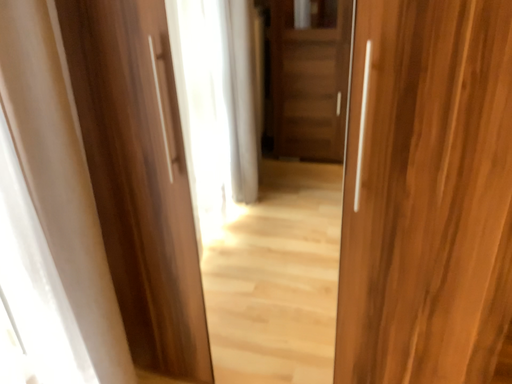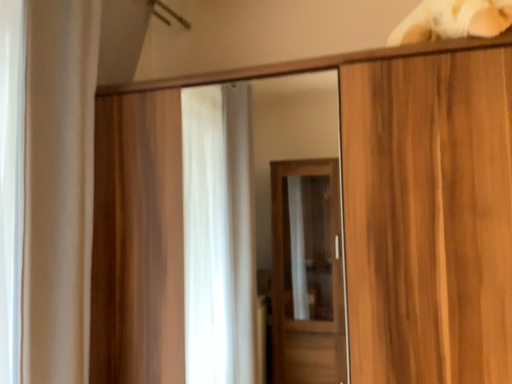
Question: Which way did the camera rotate in the video?

Choices:
 (A) rotated downward
 (B) rotated upward

Answer: (B)